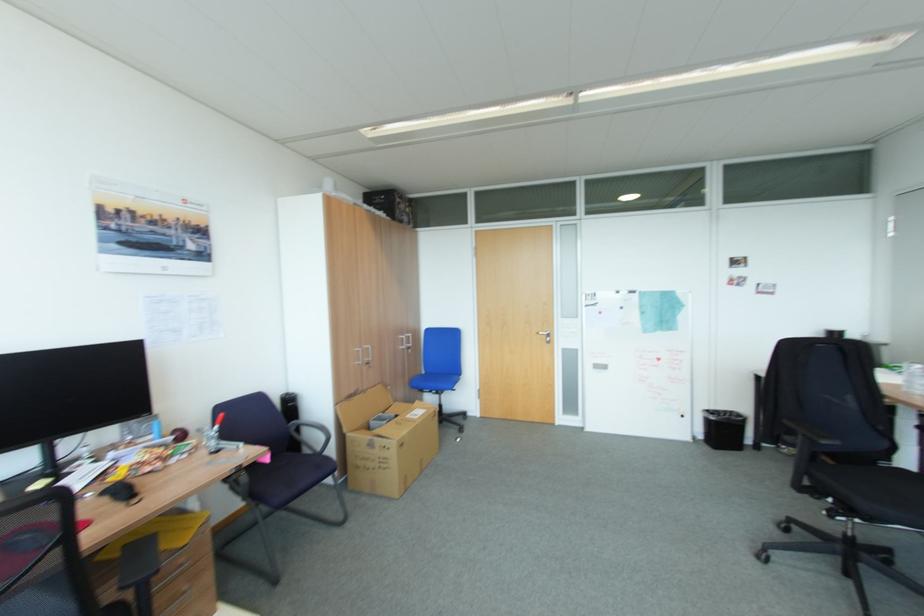
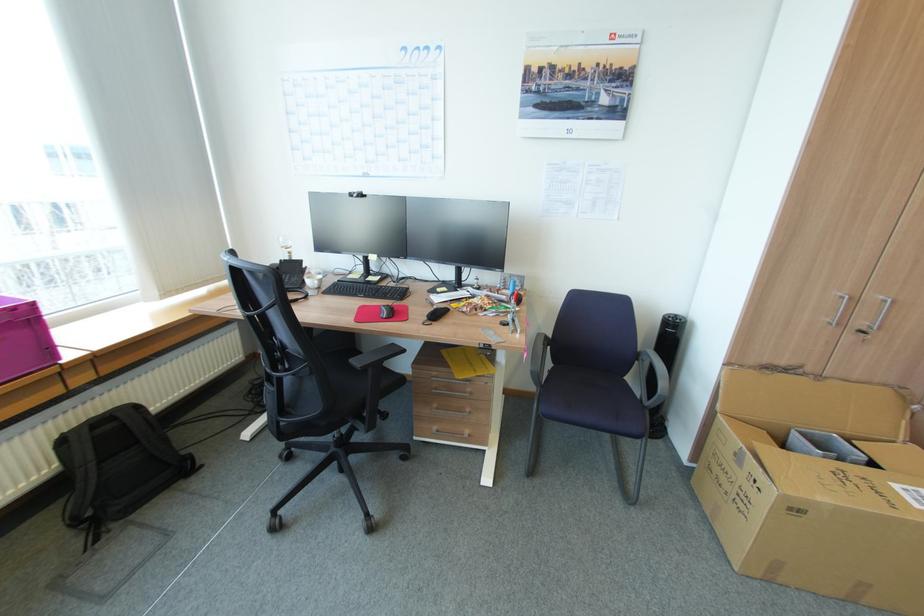
Find the pixel in the second image that matches pixel 186 567 in the first image.

(469, 392)